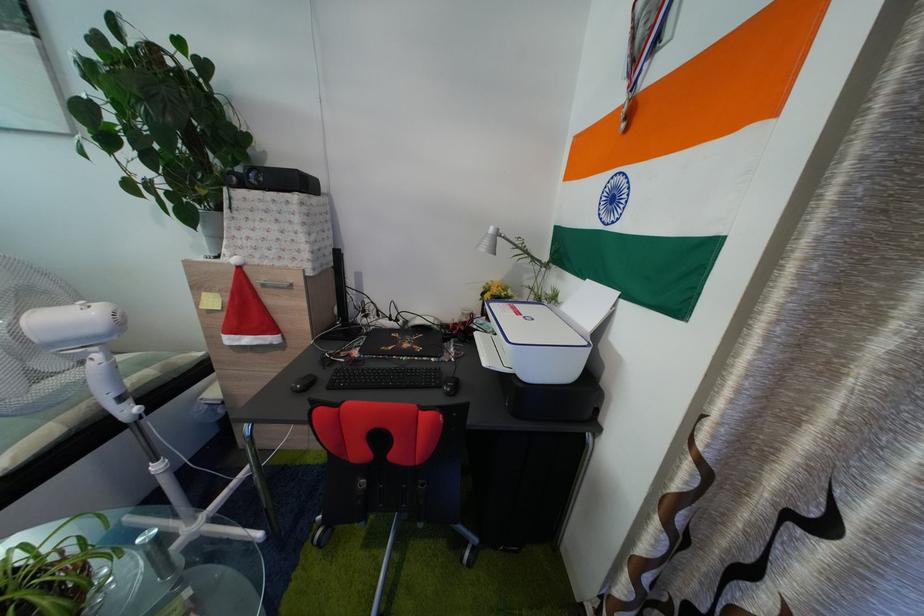
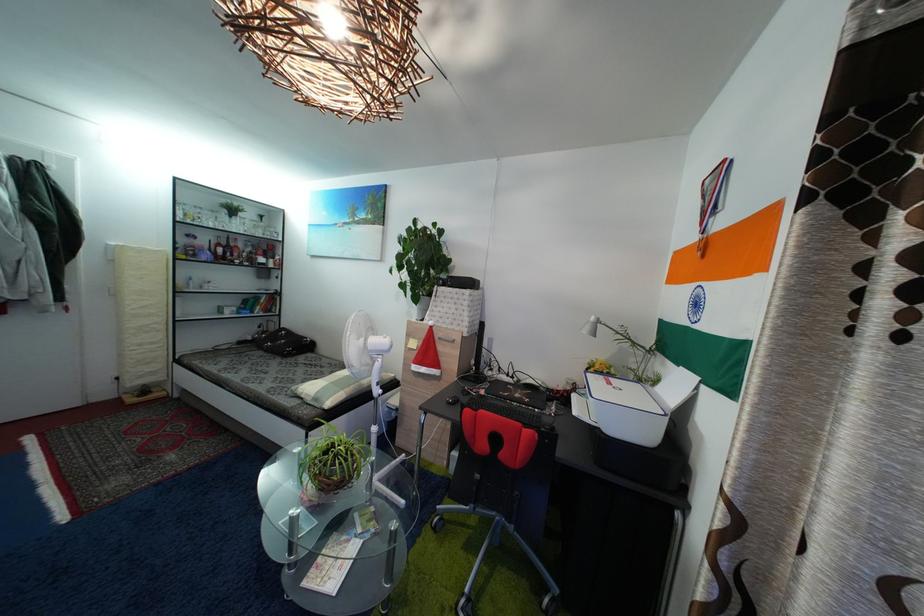
Question: How did the camera likely rotate?

Choices:
 (A) Left
 (B) Right
 (C) Up
 (D) Down

Answer: (A)